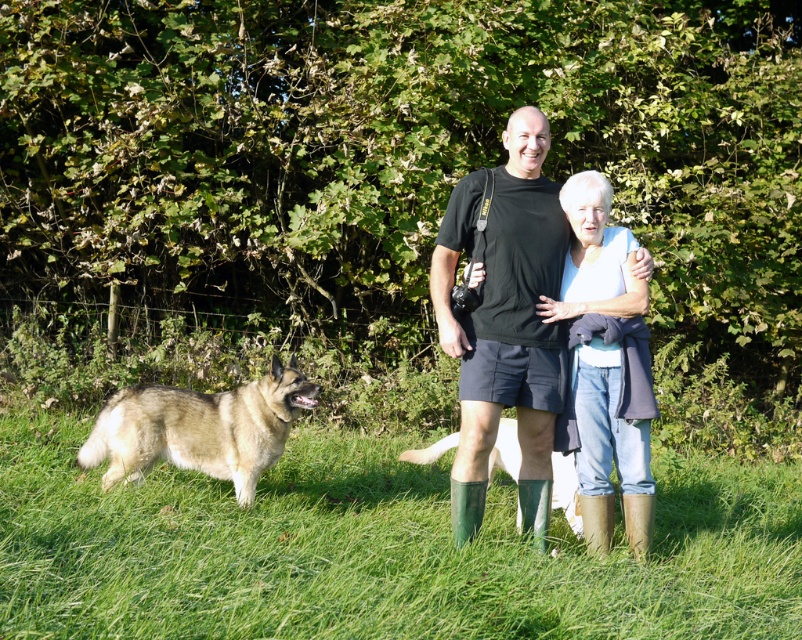
Is point (448, 257) farther from camera compared to point (602, 397)?

No, (448, 257) is closer to viewer.

Is black matte t-shirt at center thinner than denim jeans at center?

In fact, black matte t-shirt at center might be wider than denim jeans at center.

I want to click on black matte t-shirt at center, so click(x=504, y=321).

Where is `black matte t-shirt at center`? black matte t-shirt at center is located at coordinates (504, 321).

Is point (369, 564) in front of point (515, 436)?

Yes, point (369, 564) is closer to viewer.

Does green grass at lower center appear over brown fur dog at center?

No, green grass at lower center is not above brown fur dog at center.

Does point (630, 632) lie in front of point (508, 449)?

Yes, point (630, 632) is in front of point (508, 449).

At what (x,y) coordinates should I click in order to perform the action: click on green grass at lower center. Please return your answer as a coordinate pair (x, y). Looking at the image, I should click on click(375, 550).

Who is more forward, (780, 493) or (573, 298)?

Positioned in front is point (573, 298).

Find the location of a particular element. The height and width of the screenshot is (640, 802). green grass at lower center is located at coordinates (375, 550).